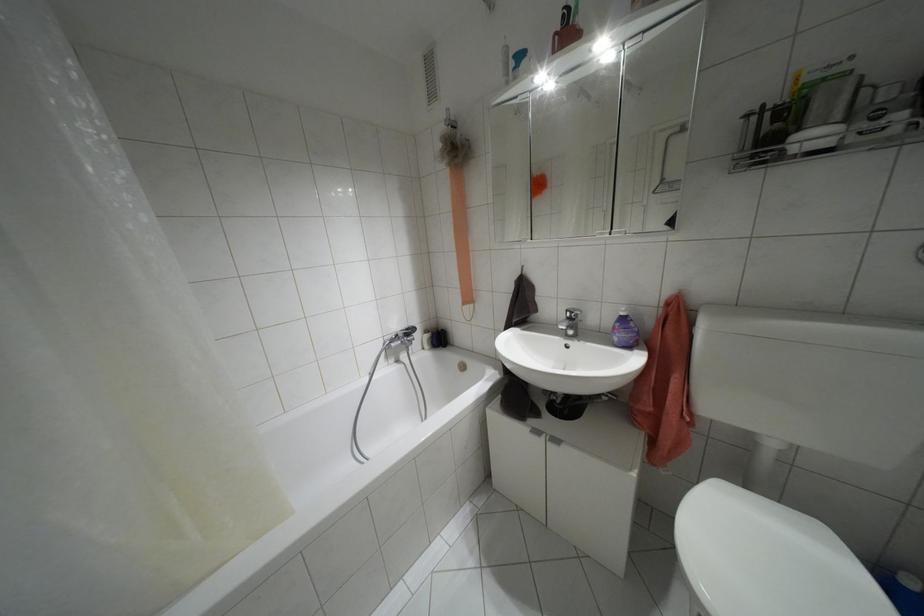
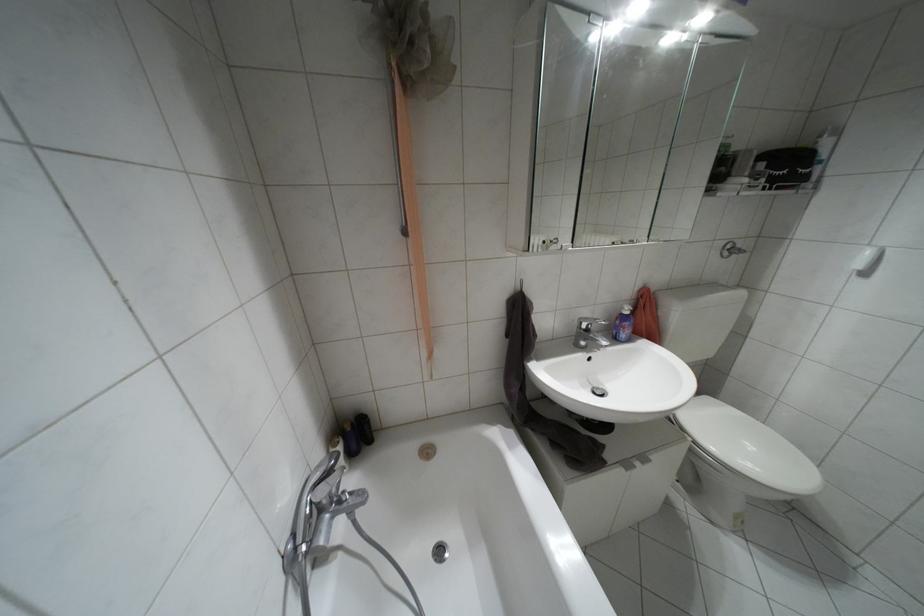
Where in the second image is the point corresponding to (569,318) from the first image?

(587, 330)